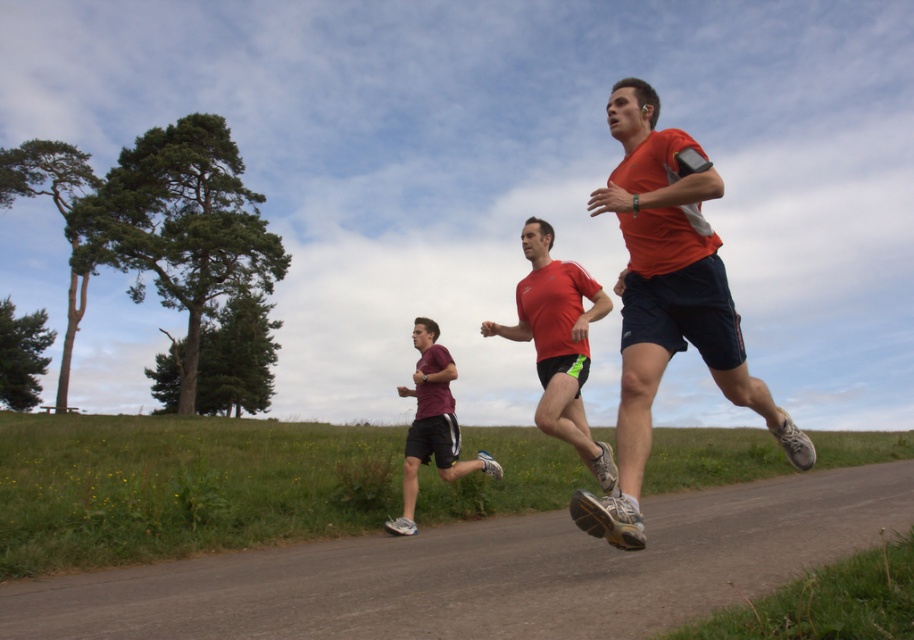
In the scene shown: Can you confirm if orange fabric shirt at center is bigger than maroon fabric shorts at center?

Yes.

Does orange fabric shirt at center appear on the left side of maroon fabric shorts at center?

In fact, orange fabric shirt at center is to the right of maroon fabric shorts at center.

Is point (671, 289) positioned before point (407, 525)?

Yes, point (671, 289) is closer to viewer.

The width and height of the screenshot is (914, 640). Identify the location of orange fabric shirt at center. [666, 301].

Does orange fabric shirt at center appear under matte red shirt at center?

No, orange fabric shirt at center is not below matte red shirt at center.

Can you confirm if orange fabric shirt at center is positioned above matte red shirt at center?

Yes.

Measure the distance between orange fabric shirt at center and camera.

10.55 feet

This screenshot has height=640, width=914. I want to click on orange fabric shirt at center, so click(x=666, y=301).

Is matte red shirt at center bigger than maroon fabric shorts at center?

No.

From the picture: Which is more to the right, matte red shirt at center or maroon fabric shorts at center?

Positioned to the right is matte red shirt at center.

Who is more distant from viewer, (547,323) or (422,406)?

The point (422,406) is more distant.

Image resolution: width=914 pixels, height=640 pixels. What are the coordinates of `matte red shirt at center` in the screenshot? It's located at (559, 342).